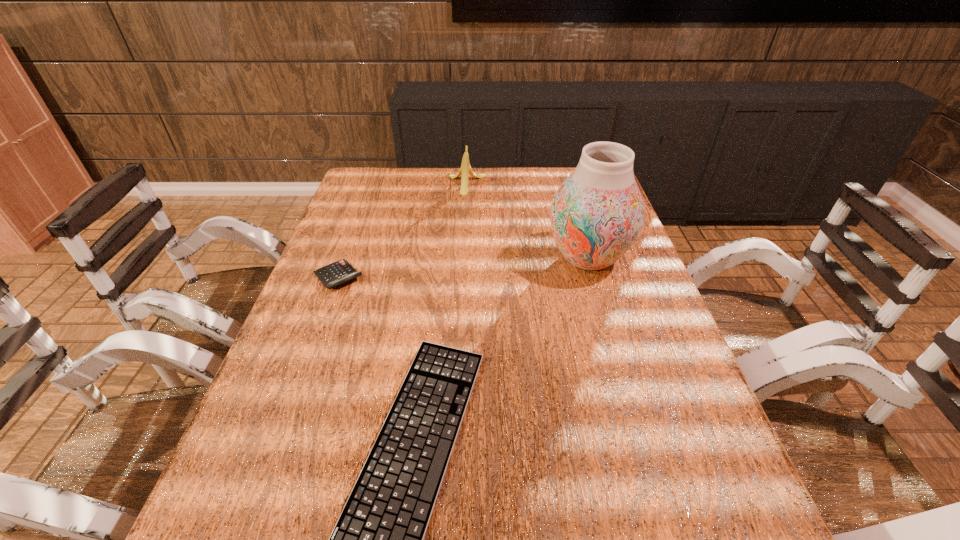
This screenshot has height=540, width=960. I want to click on vacant space that's between the tallest object and the calculator, so click(463, 268).

Identify which object is the second nearest to the leftmost object. Please provide its 2D coordinates. Your answer should be formatted as a tuple, i.e. [(x, y)], where the tuple contains the x and y coordinates of a point satisfying the conditions above.

[(465, 170)]

The image size is (960, 540). I want to click on object that stands as the third closest to the banana, so click(x=378, y=539).

Where is `vacant area in the image that satisfies the following two spatial constraints: 1. on the front side of the farthest object; 2. on the right side of the vase`? This screenshot has width=960, height=540. vacant area in the image that satisfies the following two spatial constraints: 1. on the front side of the farthest object; 2. on the right side of the vase is located at coordinates (463, 258).

At what (x,y) coordinates should I click in order to perform the action: click on free point that satisfies the following two spatial constraints: 1. on the back side of the calculator; 2. on the left side of the tallest object. Please return your answer as a coordinate pair (x, y). The width and height of the screenshot is (960, 540). Looking at the image, I should click on (346, 258).

Locate an element on the screen. blank area in the image that satisfies the following two spatial constraints: 1. on the back side of the second shortest object; 2. on the left side of the tallest object is located at coordinates (346, 258).

Identify the location of vacant space that satisfies the following two spatial constraints: 1. on the back side of the leftmost object; 2. on the right side of the second tallest object. This screenshot has height=540, width=960. (372, 184).